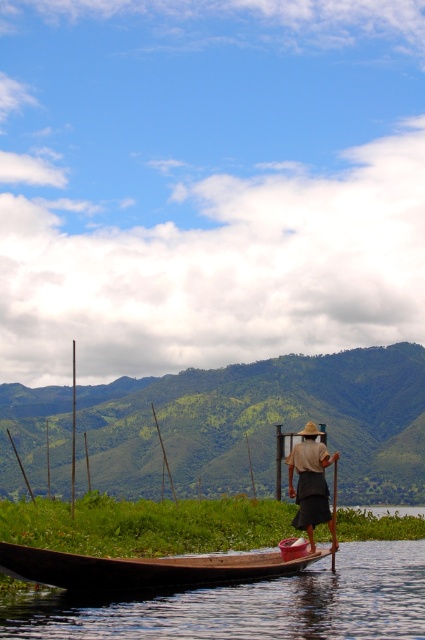
Question: Which is farther from the brown woven hat at center?

Choices:
 (A) wooden paddle at lower center
 (B) brown wooden boat at lower left

Answer: (B)

Question: Does brown wooden canoe at lower center appear on the left side of wooden paddle at lower center?

Choices:
 (A) no
 (B) yes

Answer: (B)

Question: Based on their relative distances, which object is nearer to the brown woven hat at center?

Choices:
 (A) wooden paddle at lower center
 (B) brown wooden canoe at lower center

Answer: (A)

Question: Does brown wooden boat at lower left have a smaller size compared to wooden paddle at lower center?

Choices:
 (A) yes
 (B) no

Answer: (B)

Question: Can you confirm if brown wooden boat at lower left is smaller than brown wooden canoe at lower center?

Choices:
 (A) yes
 (B) no

Answer: (B)

Question: Among these objects, which one is farthest from the camera?

Choices:
 (A) wooden paddle at lower center
 (B) brown wooden canoe at lower center
 (C) brown wooden boat at lower left
 (D) brown woven hat at center

Answer: (D)